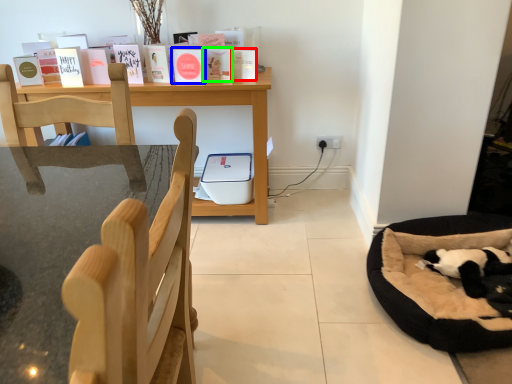
Question: Which object is the closest to the paperback book (highlighted by a red box)? Choose among these: paperback book (highlighted by a blue box) or paperback book (highlighted by a green box).

Choices:
 (A) paperback book
 (B) paperback book

Answer: (B)